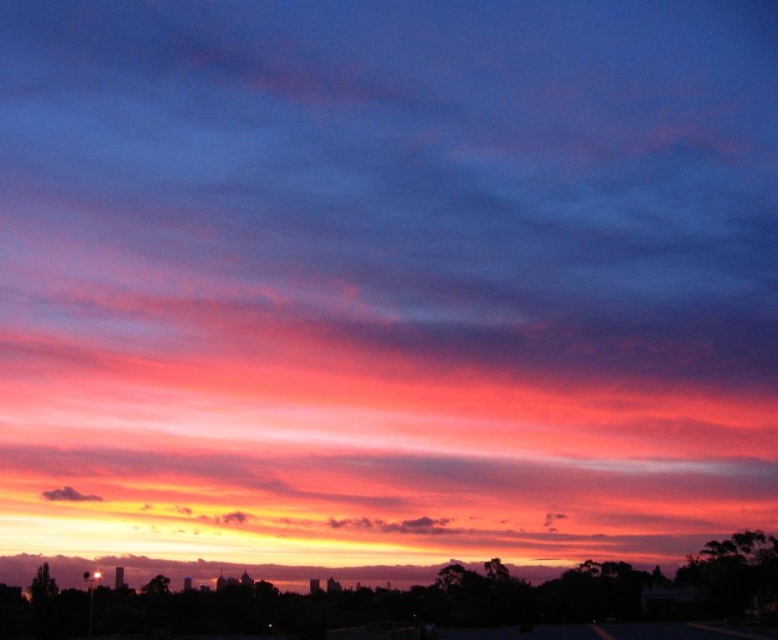
Question: Which point is closer to the camera?

Choices:
 (A) (738, 532)
 (B) (48, 496)

Answer: (A)

Question: Where is silhouette skyline at lower center located in relation to dark gray cloud at lower left in the image?

Choices:
 (A) below
 (B) above

Answer: (A)

Question: Is silhouette skyline at lower center thinner than dark gray cloud at lower left?

Choices:
 (A) yes
 (B) no

Answer: (B)

Question: Is silhouette skyline at lower center closer to camera compared to dark gray cloud at lower left?

Choices:
 (A) yes
 (B) no

Answer: (A)